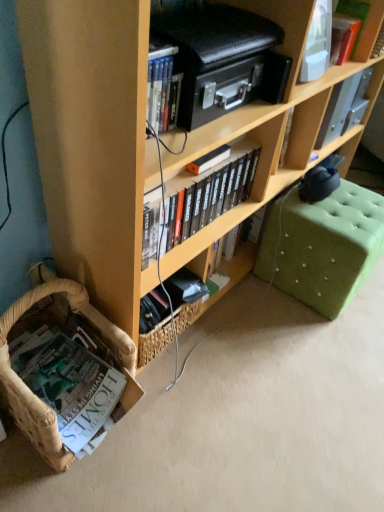
Question: From a real-world perspective, does white paper book at lower left, the 1th book when ordered from left to right, sit lower than hardcover book at upper right, the 3th book when ordered from bottom to top?

Choices:
 (A) no
 (B) yes

Answer: (B)

Question: Is white paper book at lower left, which is the 1th book in bottom-to-top order, to the left of hardcover book at upper right, which is the 1th book in right-to-left order, from the viewer's perspective?

Choices:
 (A) no
 (B) yes

Answer: (B)

Question: From a real-world perspective, is white paper book at lower left, the 1th book when ordered from left to right, physically above hardcover book at upper right, which is the 1th book in right-to-left order?

Choices:
 (A) no
 (B) yes

Answer: (A)

Question: From the image's perspective, does white paper book at lower left, arranged as the third book when viewed from the right, appear lower than hardcover book at upper right, the third book viewed from the left?

Choices:
 (A) yes
 (B) no

Answer: (A)

Question: Is white paper book at lower left, arranged as the third book when viewed from the right, positioned behind hardcover book at upper right, which is the 1th book in right-to-left order?

Choices:
 (A) yes
 (B) no

Answer: (B)

Question: Would you say white paper book at lower left, the 1th book when ordered from left to right, is to the left or to the right of black matte bookshelf at center, the 2th book from the top, in the picture?

Choices:
 (A) right
 (B) left

Answer: (B)

Question: From a real-world perspective, relative to black matte bookshelf at center, the second book viewed from the left, is white paper book at lower left, which is the 1th book in bottom-to-top order, vertically above or below?

Choices:
 (A) above
 (B) below

Answer: (B)

Question: Considering the positions of white paper book at lower left, the 3th book when ordered from top to bottom, and black matte bookshelf at center, the second book viewed from the left, in the image, is white paper book at lower left, the 3th book when ordered from top to bottom, taller or shorter than black matte bookshelf at center, the second book viewed from the left,?

Choices:
 (A) tall
 (B) short

Answer: (B)

Question: From the image's perspective, is white paper book at lower left, which is the 1th book in bottom-to-top order, positioned above or below black matte bookshelf at center, the second book when ordered from right to left?

Choices:
 (A) above
 (B) below

Answer: (B)

Question: Is point (82, 103) closer or farther from the camera than point (349, 3)?

Choices:
 (A) closer
 (B) farther

Answer: (A)

Question: In the image, is wooden bookcase at lower left positioned in front of or behind hardcover book at upper right, acting as the 1th book starting from the top?

Choices:
 (A) front
 (B) behind

Answer: (A)

Question: From a real-world perspective, relative to hardcover book at upper right, the 3th book when ordered from bottom to top, is wooden bookcase at lower left vertically above or below?

Choices:
 (A) below
 (B) above

Answer: (A)

Question: In terms of height, does wooden bookcase at lower left look taller or shorter compared to hardcover book at upper right, the third book viewed from the left?

Choices:
 (A) tall
 (B) short

Answer: (A)

Question: Based on their sizes in the image, would you say wooden bookcase at lower left is bigger or smaller than green tufted ottoman at lower right?

Choices:
 (A) small
 (B) big

Answer: (B)

Question: Is wooden bookcase at lower left taller or shorter than green tufted ottoman at lower right?

Choices:
 (A) short
 (B) tall

Answer: (B)